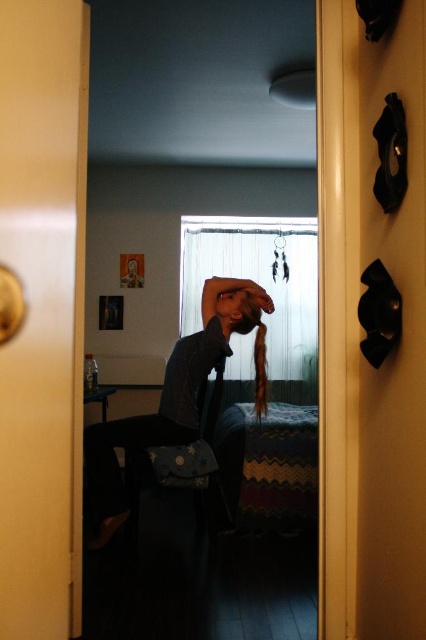
Question: Is denim jacket at center smaller than matte black hair at center?

Choices:
 (A) no
 (B) yes

Answer: (A)

Question: Does denim jacket at center appear on the left side of matte black hair at center?

Choices:
 (A) yes
 (B) no

Answer: (A)

Question: Is denim jacket at center further to the viewer compared to matte black hair at center?

Choices:
 (A) no
 (B) yes

Answer: (A)

Question: Which point is closer to the camera?

Choices:
 (A) denim jacket at center
 (B) matte black hair at center

Answer: (A)